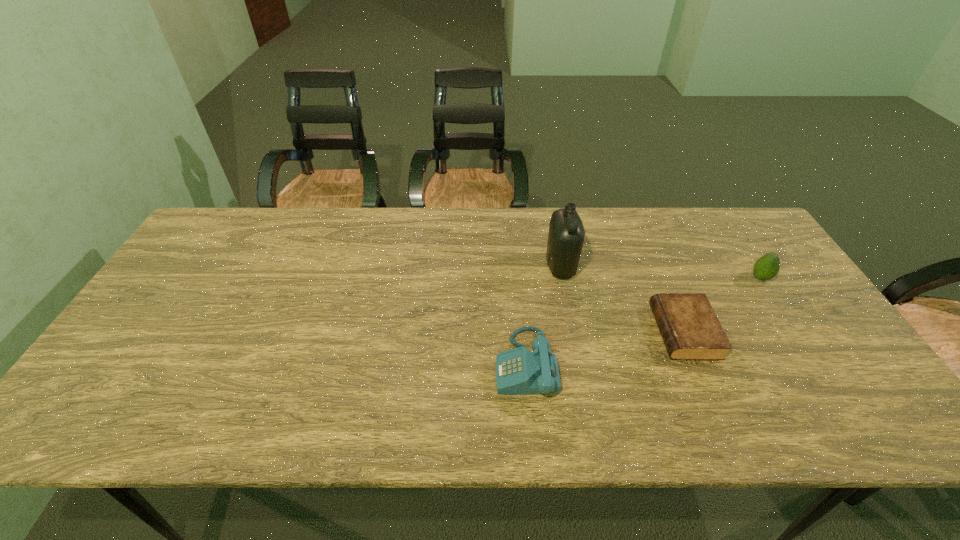
I want to click on free space between the avocado and the shortest object, so click(x=723, y=305).

Where is `free space between the telephone and the diary`? free space between the telephone and the diary is located at coordinates (605, 348).

Choose which object is the nearest neighbor to the shortest object. Please provide its 2D coordinates. Your answer should be formatted as a tuple, i.e. [(x, y)], where the tuple contains the x and y coordinates of a point satisfying the conditions above.

[(566, 235)]

This screenshot has height=540, width=960. Identify the location of object that is the closest one to the leftmost object. (566, 235).

The image size is (960, 540). In order to click on free space that satisfies the following two spatial constraints: 1. on the front side of the bottle; 2. on the dial of the telephone in this screenshot , I will do `click(580, 364)`.